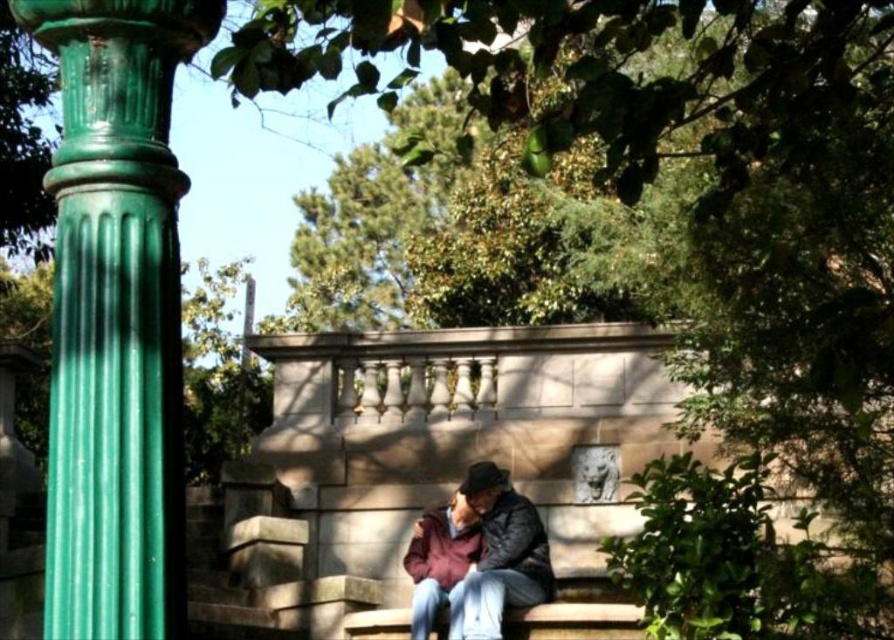
Question: Is green polished stone column at left bigger than maroon fabric jacket at center?

Choices:
 (A) no
 (B) yes

Answer: (A)

Question: Is green polished stone column at left wider than maroon fabric jacket at center?

Choices:
 (A) yes
 (B) no

Answer: (B)

Question: Does green polished stone column at left have a smaller size compared to maroon fabric jacket at center?

Choices:
 (A) yes
 (B) no

Answer: (A)

Question: Which of the following is the closest to the observer?

Choices:
 (A) (115, 234)
 (B) (423, 563)

Answer: (A)